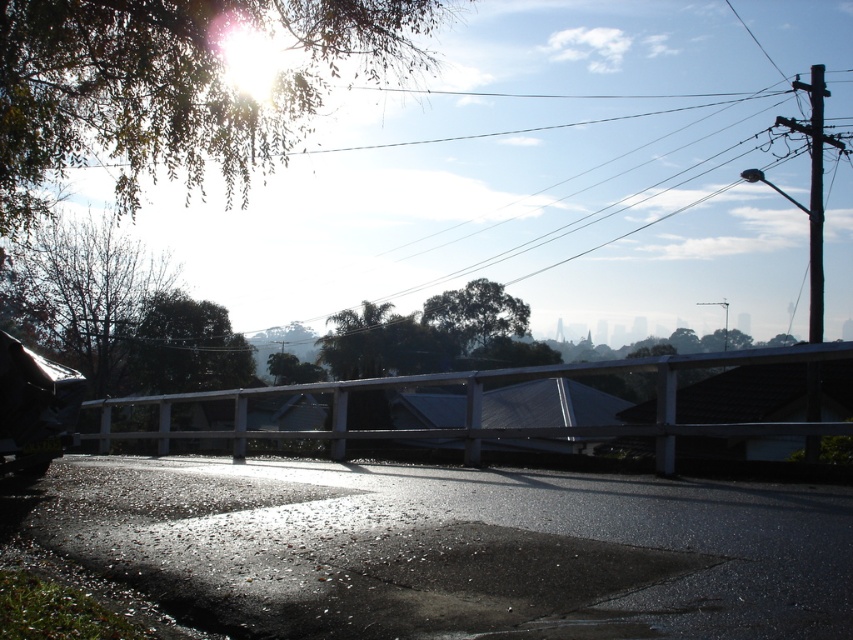
Is white wooden rail at center thinner than brown leafy tree at left?

No, white wooden rail at center is not thinner than brown leafy tree at left.

Is white wooden rail at center positioned behind brown leafy tree at left?

No.

What do you see at coordinates (480, 406) in the screenshot? The width and height of the screenshot is (853, 640). I see `white wooden rail at center` at bounding box center [480, 406].

The height and width of the screenshot is (640, 853). I want to click on white wooden rail at center, so click(x=480, y=406).

Is point (125, 106) less distant than point (735, 360)?

No.

Is green leafy tree at upper left in front of white wooden rail at center?

No, it is not.

Does point (396, 17) lie behind point (682, 433)?

Yes, it is.

Locate an element on the screen. green leafy tree at upper left is located at coordinates (181, 84).

Measure the distance between green leafy tree at upper left and green leafy tree at center.

green leafy tree at upper left is 77.70 feet away from green leafy tree at center.

Which of these two, green leafy tree at upper left or green leafy tree at center, stands taller?

green leafy tree at upper left is taller.

Between point (190, 49) and point (506, 301), which one is positioned behind?

The point (506, 301) is behind.

Find the location of `green leafy tree at upper left`. green leafy tree at upper left is located at coordinates (181, 84).